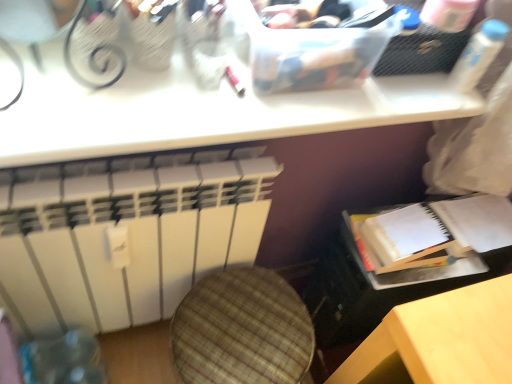
Question: Can you confirm if white paper journal at lower right is taller than white plastic bottle at upper right?

Choices:
 (A) no
 (B) yes

Answer: (A)

Question: Is white paper journal at lower right positioned before white plastic bottle at upper right?

Choices:
 (A) yes
 (B) no

Answer: (B)

Question: Is white paper journal at lower right to the left of white plastic bottle at upper right from the viewer's perspective?

Choices:
 (A) no
 (B) yes

Answer: (B)

Question: Is white paper journal at lower right outside of white plastic bottle at upper right?

Choices:
 (A) no
 (B) yes

Answer: (B)

Question: Does white paper journal at lower right lie behind white plastic bottle at upper right?

Choices:
 (A) no
 (B) yes

Answer: (B)

Question: Is white paper journal at lower right touching white plastic bottle at upper right?

Choices:
 (A) no
 (B) yes

Answer: (A)

Question: Is white matte radiator at lower left directly adjacent to white paper journal at lower right?

Choices:
 (A) yes
 (B) no

Answer: (B)

Question: Considering the relative positions of white matte radiator at lower left and white paper journal at lower right in the image provided, is white matte radiator at lower left behind white paper journal at lower right?

Choices:
 (A) no
 (B) yes

Answer: (A)

Question: Is white matte radiator at lower left positioned far away from white paper journal at lower right?

Choices:
 (A) no
 (B) yes

Answer: (A)

Question: From the image's perspective, does white matte radiator at lower left appear lower than white paper journal at lower right?

Choices:
 (A) yes
 (B) no

Answer: (A)

Question: Can you confirm if white matte radiator at lower left is taller than white paper journal at lower right?

Choices:
 (A) no
 (B) yes

Answer: (B)

Question: Considering the relative sizes of white matte radiator at lower left and white paper journal at lower right in the image provided, is white matte radiator at lower left bigger than white paper journal at lower right?

Choices:
 (A) yes
 (B) no

Answer: (A)

Question: Is white paper journal at lower right shorter than white matte radiator at lower left?

Choices:
 (A) yes
 (B) no

Answer: (A)